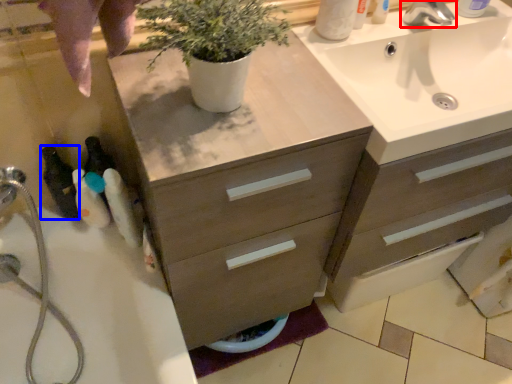
Question: Which of the following is the farthest to the observer, tap (highlighted by a red box) or toiletry (highlighted by a blue box)?

Choices:
 (A) tap
 (B) toiletry

Answer: (A)